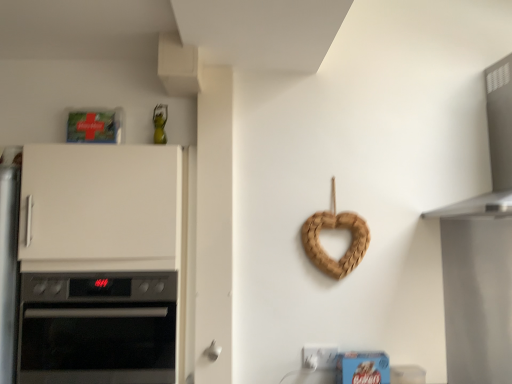
What do you see at coordinates (98, 327) in the screenshot?
I see `black glass oven at left` at bounding box center [98, 327].

Locate an element on the screen. This screenshot has width=512, height=384. braided wood heart at center-right is located at coordinates (334, 228).

Measure the distance between white matte door handle at lower center and camera.

The depth of white matte door handle at lower center is 5.56 feet.

I want to click on black glass oven at left, so click(98, 327).

What's the angular difference between white matte door handle at lower center and braided wood heart at center-right's facing directions?

There is a 0.249-degree angle between the facing directions of white matte door handle at lower center and braided wood heart at center-right.

Is point (203, 354) behind point (355, 256)?

No, (203, 354) is closer to viewer.

Based on the photo, considering the relative sizes of white matte door handle at lower center and braided wood heart at center-right in the image provided, is white matte door handle at lower center smaller than braided wood heart at center-right?

Yes.

Which of these two, white matte door handle at lower center or braided wood heart at center-right, is wider?

braided wood heart at center-right is wider.

Are black glass oven at left and white matte door handle at lower center beside each other?

black glass oven at left and white matte door handle at lower center are not in contact.

Is black glass oven at left taller or shorter than white matte door handle at lower center?

In the image, black glass oven at left appears to be taller than white matte door handle at lower center.

Can you tell me how much black glass oven at left and white matte door handle at lower center differ in facing direction?

black glass oven at left and white matte door handle at lower center are facing 0.878 degrees away from each other.

Does black glass oven at left have a smaller size compared to white matte door handle at lower center?

No, black glass oven at left is not smaller than white matte door handle at lower center.

You are a GUI agent. You are given a task and a screenshot of the screen. Output one action in this format:
    pyautogui.click(x=<x>, y=<y>)
    Task: Click on the cabinetry that appears above the white matte door handle at lower center (from the image's perspective)
    The width and height of the screenshot is (512, 384).
    Given the screenshot: What is the action you would take?
    pos(100,208)

Could white matte cabinet at left be considered to be inside white matte door handle at lower center?

That's incorrect, white matte cabinet at left is not inside white matte door handle at lower center.

Considering the sizes of white matte door handle at lower center and white matte cabinet at left in the image, is white matte door handle at lower center taller or shorter than white matte cabinet at left?

white matte door handle at lower center is shorter than white matte cabinet at left.

Is white matte door handle at lower center facing away from satin silver vent at upper right?

No, satin silver vent at upper right is not at the back of white matte door handle at lower center.

Visually, is white matte door handle at lower center positioned to the left or to the right of satin silver vent at upper right?

In the image, white matte door handle at lower center appears on the left side of satin silver vent at upper right.

Is white matte door handle at lower center far away from satin silver vent at upper right?

white matte door handle at lower center is far away from satin silver vent at upper right.

Considering the relative sizes of white matte door handle at lower center and satin silver vent at upper right in the image provided, is white matte door handle at lower center smaller than satin silver vent at upper right?

Yes.

Considering the positions of objects white matte cabinet at left and satin silver vent at upper right in the image provided, who is more to the right, white matte cabinet at left or satin silver vent at upper right?

satin silver vent at upper right.

Is white matte cabinet at left facing away from satin silver vent at upper right?

No, satin silver vent at upper right is not at the back of white matte cabinet at left.

From the image's perspective, which one is positioned lower, white matte cabinet at left or satin silver vent at upper right?

white matte cabinet at left appears lower in the image.

Which of these two, white matte door handle at lower center or black glass oven at left, stands shorter?

white matte door handle at lower center.

Is white matte door handle at lower center oriented towards black glass oven at left?

No, white matte door handle at lower center is not aimed at black glass oven at left.

Which is behind, point (211, 357) or point (109, 294)?

The point (211, 357) is farther from the camera.

Consider the image. Is white matte door handle at lower center positioned in front of black glass oven at left?

No, it is not.

Consider the image. Between white matte cabinet at left and braided wood heart at center-right, which one has smaller width?

With smaller width is braided wood heart at center-right.

Between point (25, 169) and point (303, 233), which one is positioned in front?

The point (25, 169) is closer.

From the image's perspective, which one is positioned lower, white matte cabinet at left or braided wood heart at center-right?

white matte cabinet at left, from the image's perspective.

The width and height of the screenshot is (512, 384). Identify the location of appliance above the white matte door handle at lower center (from a real-world perspective). (334, 228).

The image size is (512, 384). Identify the location of door handle below the black glass oven at left (from the image's perspective). (212, 351).

Looking at the image, which one is located further to satin silver vent at upper right, black glass oven at left or white matte cabinet at left?

The object further to satin silver vent at upper right is black glass oven at left.

From the image, which object appears to be farther from white matte door handle at lower center, white matte cabinet at left or braided wood heart at center-right?

white matte cabinet at left.

Based on their spatial positions, is white matte door handle at lower center or white matte cabinet at left further from black glass oven at left?

white matte door handle at lower center is positioned further to the anchor black glass oven at left.

Estimate the real-world distances between objects in this image. Which object is closer to braided wood heart at center-right, white matte cabinet at left or satin silver vent at upper right?

satin silver vent at upper right is closer to braided wood heart at center-right.

Considering their positions, is white matte cabinet at left positioned further to black glass oven at left than satin silver vent at upper right?

Result: Based on the image, satin silver vent at upper right appears to be further to black glass oven at left.

Based on their spatial positions, is black glass oven at left or braided wood heart at center-right closer to white matte cabinet at left?

black glass oven at left.

Estimate the real-world distances between objects in this image. Which object is closer to braided wood heart at center-right, white matte cabinet at left or white matte door handle at lower center?

white matte door handle at lower center lies closer to braided wood heart at center-right than the other object.

Looking at the image, which one is located closer to white matte cabinet at left, black glass oven at left or white matte door handle at lower center?

Based on the image, black glass oven at left appears to be nearer to white matte cabinet at left.

Locate an element on the screen. appliance between black glass oven at left and satin silver vent at upper right from left to right is located at coordinates (334, 228).

The image size is (512, 384). In order to click on door handle between white matte cabinet at left and satin silver vent at upper right from left to right in this screenshot , I will do [x=212, y=351].

Where is `door handle situated between black glass oven at left and satin silver vent at upper right from left to right`? door handle situated between black glass oven at left and satin silver vent at upper right from left to right is located at coordinates (212, 351).

I want to click on door handle located between black glass oven at left and braided wood heart at center-right in the left-right direction, so click(212, 351).